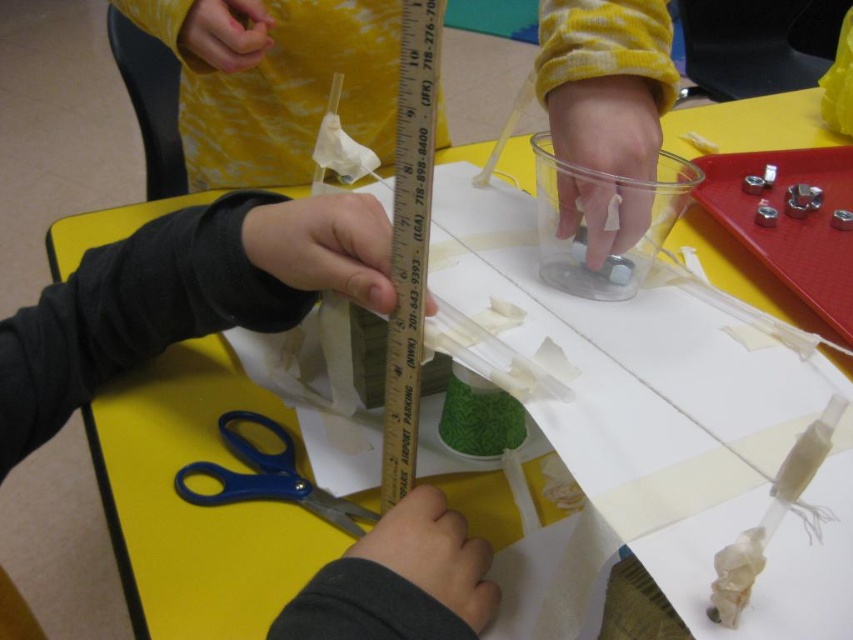
Question: Which point appears closest to the camera in this image?

Choices:
 (A) (351, 513)
 (B) (408, 252)

Answer: (B)

Question: Does metallic ruler at center have a larger size compared to blue plastic scissors at lower left?

Choices:
 (A) yes
 (B) no

Answer: (A)

Question: Does metallic ruler at center have a larger size compared to blue plastic scissors at lower left?

Choices:
 (A) no
 (B) yes

Answer: (B)

Question: Considering the relative positions of metallic ruler at center and blue plastic scissors at lower left in the image provided, where is metallic ruler at center located with respect to blue plastic scissors at lower left?

Choices:
 (A) left
 (B) right

Answer: (B)

Question: Among these points, which one is farthest from the camera?

Choices:
 (A) click(254, 472)
 (B) click(415, 180)

Answer: (A)

Question: Which point is closer to the camera taking this photo?

Choices:
 (A) (402, 136)
 (B) (231, 497)

Answer: (A)